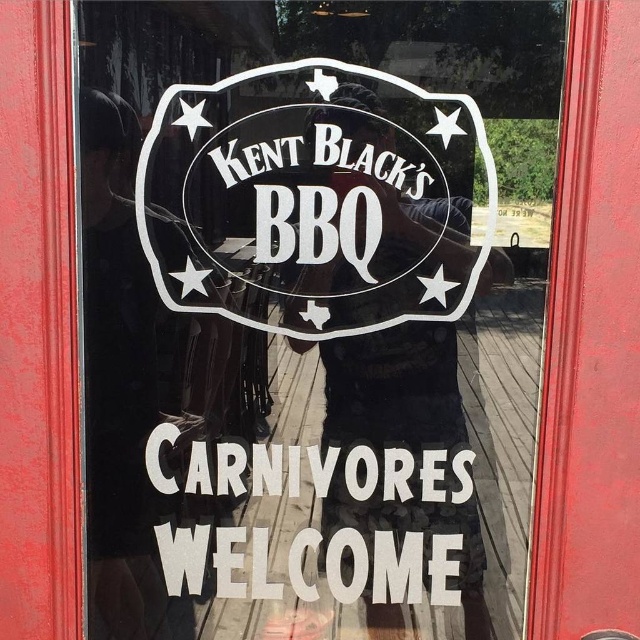
Question: Which object appears closest to the camera in this image?

Choices:
 (A) white matte sign at center
 (B) white vinyl sign at center

Answer: (B)

Question: Can you confirm if white matte sign at center is wider than white vinyl sign at center?

Choices:
 (A) yes
 (B) no

Answer: (B)

Question: Among these objects, which one is nearest to the camera?

Choices:
 (A) white matte sign at center
 (B) white vinyl sign at center

Answer: (B)

Question: Does white matte sign at center appear over white vinyl sign at center?

Choices:
 (A) yes
 (B) no

Answer: (B)

Question: Does white matte sign at center appear on the right side of white vinyl sign at center?

Choices:
 (A) yes
 (B) no

Answer: (B)

Question: Which point appears closest to the camera in this image?

Choices:
 (A) (456, 308)
 (B) (445, 541)

Answer: (A)